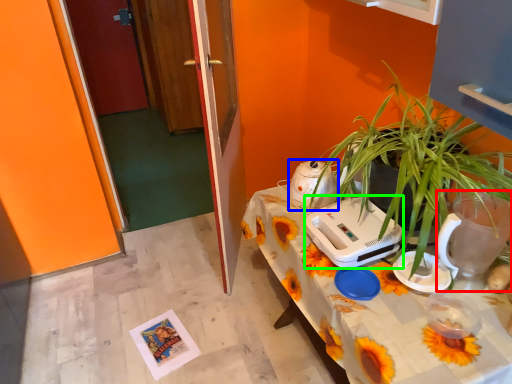
Question: Which object is positioned closest to appliance (highlighted by a red box)? Select from appliance (highlighted by a blue box) and appliance (highlighted by a green box).

Choices:
 (A) appliance
 (B) appliance

Answer: (B)